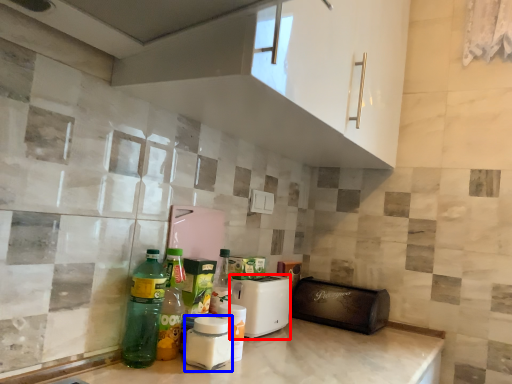
Question: Which point is further to the camera, appliance (highlighted by a red box) or bottle (highlighted by a blue box)?

Choices:
 (A) appliance
 (B) bottle

Answer: (A)